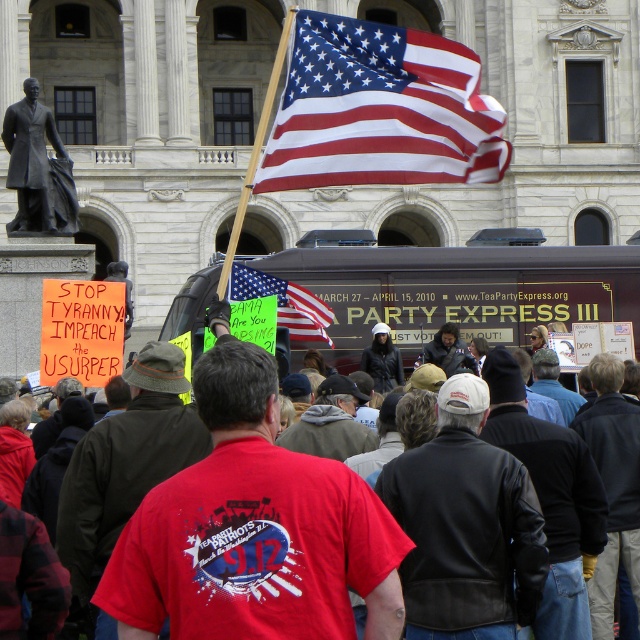
Does american flag at upper center have a smaller size compared to brown wooden food truck at center?

No.

Between american flag at upper center and brown wooden food truck at center, which one is positioned higher?

american flag at upper center is higher up.

Between point (458, 131) and point (433, 253), which one is positioned in front?

Point (458, 131) is more forward.

I want to click on american flag at upper center, so click(x=380, y=109).

Describe the element at coordinates (253, 531) in the screenshot. This screenshot has height=640, width=640. I see `red t-shirt at center` at that location.

Is point (301, 556) farther from camera compared to point (321, 17)?

No, (301, 556) is in front of (321, 17).

This screenshot has width=640, height=640. Describe the element at coordinates (253, 531) in the screenshot. I see `red t-shirt at center` at that location.

Identify the location of red t-shirt at center. (253, 531).

Does red cotton shirt at center appear on the right side of bronze statue at left?

Yes, red cotton shirt at center is to the right of bronze statue at left.

Who is higher up, red cotton shirt at center or bronze statue at left?

bronze statue at left is higher up.

The image size is (640, 640). Describe the element at coordinates (253, 529) in the screenshot. I see `red cotton shirt at center` at that location.

Locate an element on the screen. The image size is (640, 640). red cotton shirt at center is located at coordinates (253, 529).